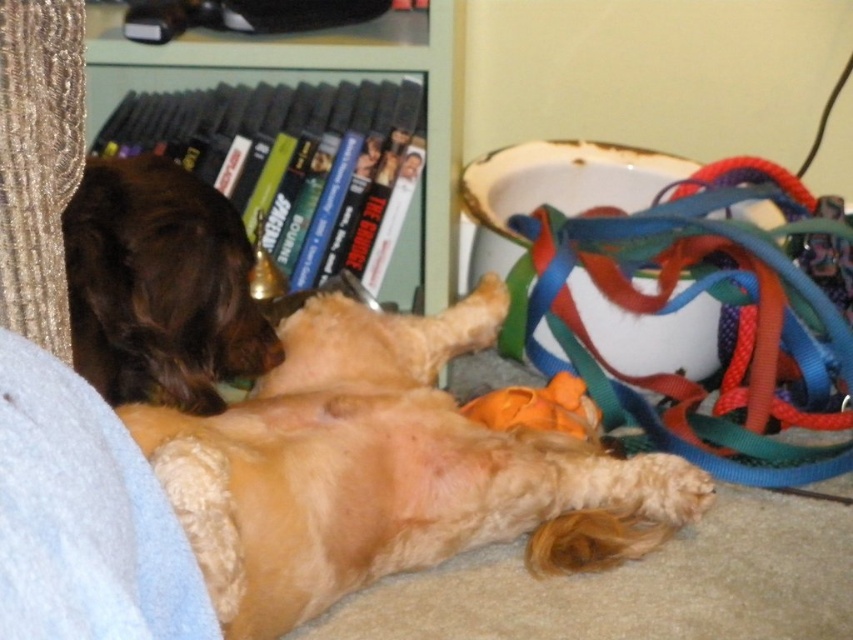
Question: Which object appears farthest from the camera in this image?

Choices:
 (A) fuzzy golden dog at center
 (B) black plastic bookshelf at upper left

Answer: (B)

Question: Is brown fuzzy dog at upper left to the left of black plastic bookshelf at upper left from the viewer's perspective?

Choices:
 (A) yes
 (B) no

Answer: (A)

Question: Is fuzzy golden dog at center positioned in front of brown fuzzy dog at upper left?

Choices:
 (A) no
 (B) yes

Answer: (B)

Question: Does fuzzy golden dog at center appear on the right side of black plastic bookshelf at upper left?

Choices:
 (A) no
 (B) yes

Answer: (B)

Question: Which point is closer to the camera?

Choices:
 (A) (96, 288)
 (B) (437, 221)
 (C) (502, 464)

Answer: (A)

Question: Among these objects, which one is nearest to the camera?

Choices:
 (A) brown fuzzy dog at upper left
 (B) fuzzy golden dog at center

Answer: (B)